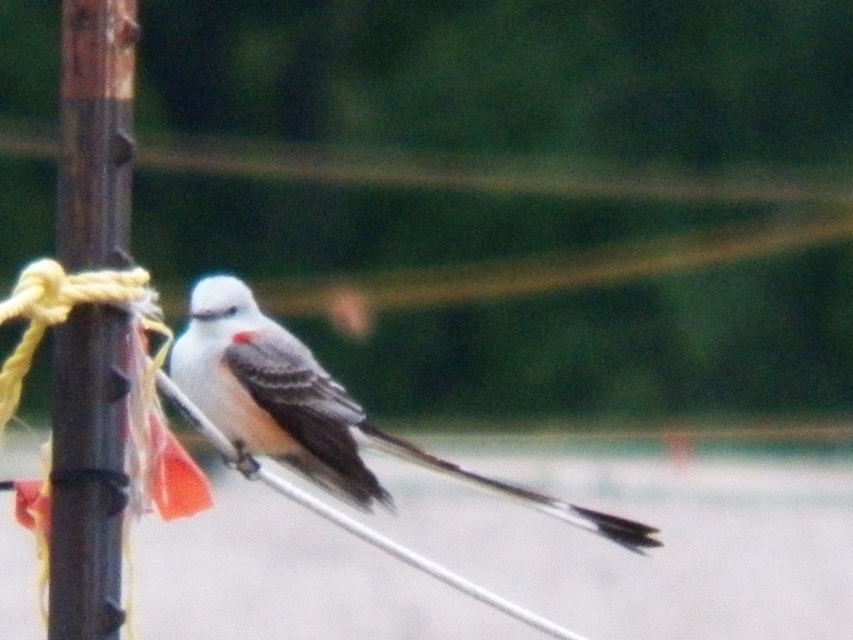
Question: Can you confirm if brown wood pole at left is wider than white matte bird at center?

Choices:
 (A) no
 (B) yes

Answer: (A)

Question: Which point is closer to the camera taking this photo?

Choices:
 (A) (67, 230)
 (B) (335, 428)

Answer: (A)

Question: Which point is closer to the camera?

Choices:
 (A) (547, 499)
 (B) (102, 173)

Answer: (B)

Question: Can you confirm if brown wood pole at left is positioned above white matte bird at center?

Choices:
 (A) yes
 (B) no

Answer: (A)

Question: From the image, what is the correct spatial relationship of brown wood pole at left in relation to white matte bird at center?

Choices:
 (A) above
 (B) below

Answer: (A)